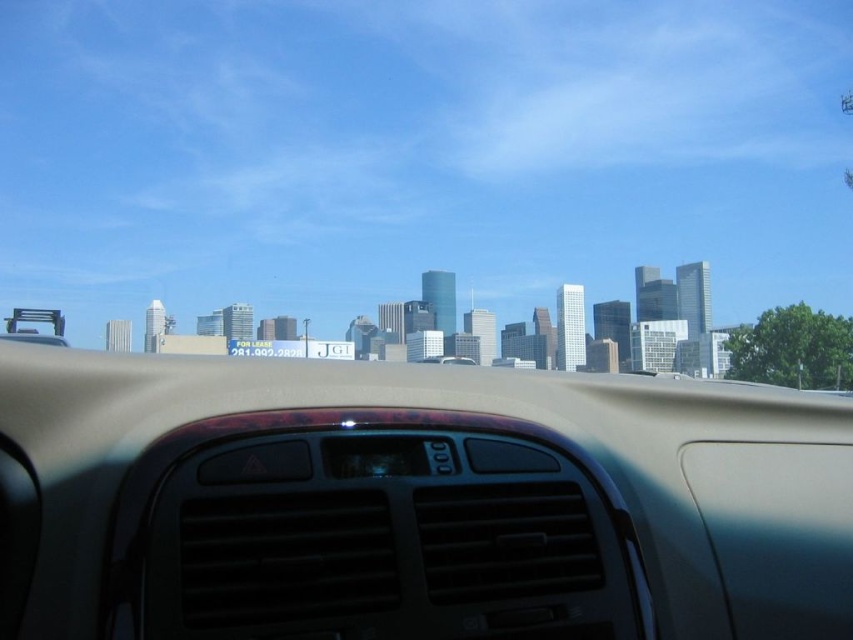
From the picture: Is beige matte dashboard at center below transparent plastic air vent at center?

No.

Between beige matte dashboard at center and transparent plastic air vent at center, which one has more height?

Standing taller between the two is beige matte dashboard at center.

Measure the distance between beige matte dashboard at center and camera.

8.68 meters

The image size is (853, 640). Find the location of `beige matte dashboard at center`. beige matte dashboard at center is located at coordinates (413, 500).